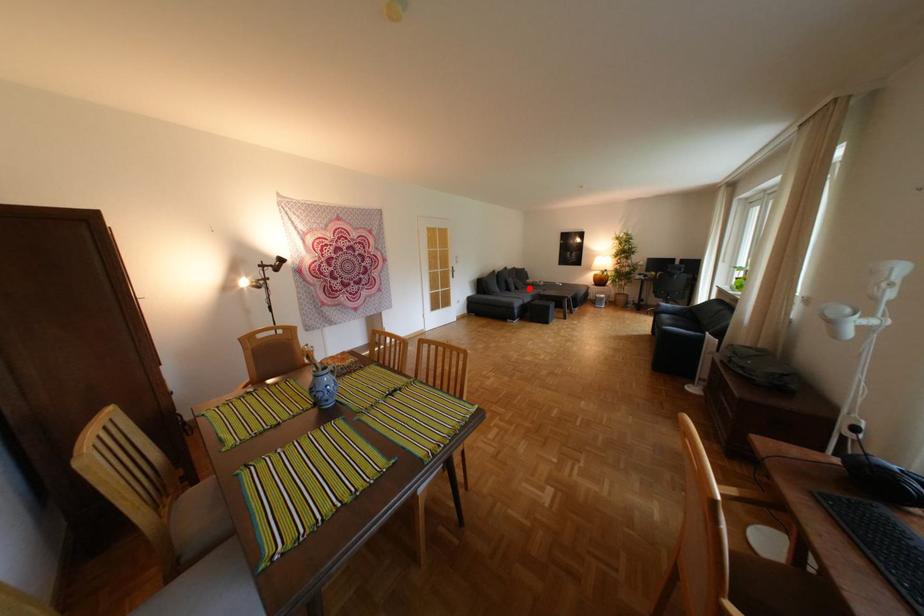
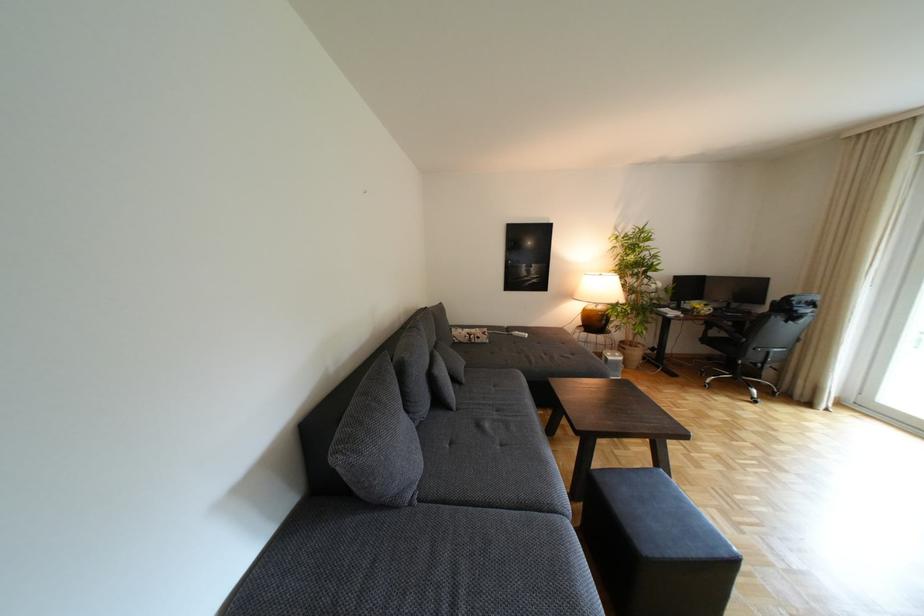
Question: I am providing you with two images of the same scene from different viewpoints. A red point is marked on the first image. Can you still see the location of the red point in image 2?

Choices:
 (A) Yes
 (B) No

Answer: (A)